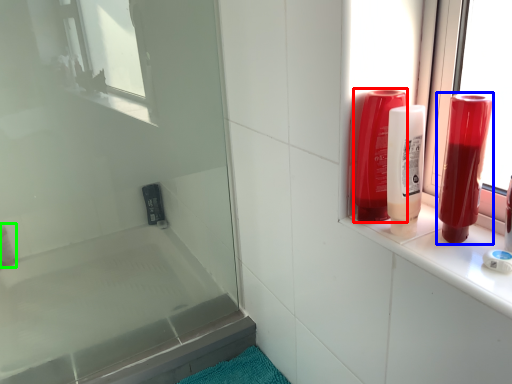
Question: Which object is positioned closest to mouthwash (highlighted by a red box)? Select from mouthwash (highlighted by a blue box) and toiletry (highlighted by a green box).

Choices:
 (A) mouthwash
 (B) toiletry

Answer: (A)